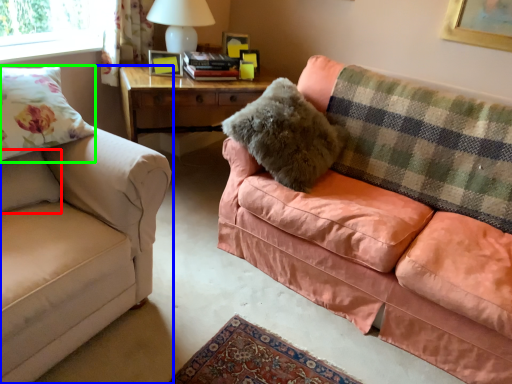
Question: Based on their relative distances, which object is nearer to pillow (highlighted by a red box)? Choose from studio couch (highlighted by a blue box) and throw pillow (highlighted by a green box).

Choices:
 (A) studio couch
 (B) throw pillow

Answer: (B)